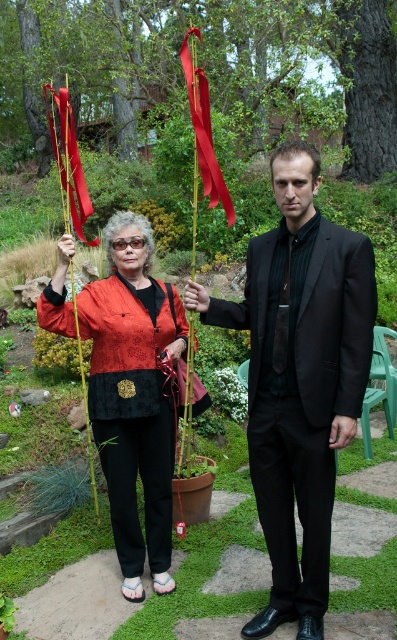
Question: Can you confirm if silky red ribbon at center is smaller than silky red ribbon at left?

Choices:
 (A) no
 (B) yes

Answer: (B)

Question: Which object is positioned farthest from the matte black blouse at center?

Choices:
 (A) silky red ribbon at left
 (B) silky red ribbon at center
 (C) black satin suit at center

Answer: (A)

Question: Can you confirm if black satin suit at center is wider than matte black blouse at center?

Choices:
 (A) yes
 (B) no

Answer: (A)

Question: Which point is farther to the camera?

Choices:
 (A) (138, 300)
 (B) (67, 225)
 (C) (300, 500)
 (D) (211, 145)

Answer: (B)

Question: Which of the following is the closest to the observer?

Choices:
 (A) silky red ribbon at left
 (B) matte black blouse at center
 (C) black satin suit at center

Answer: (C)

Question: Is black satin suit at center to the right of silky red ribbon at center from the viewer's perspective?

Choices:
 (A) no
 (B) yes

Answer: (B)